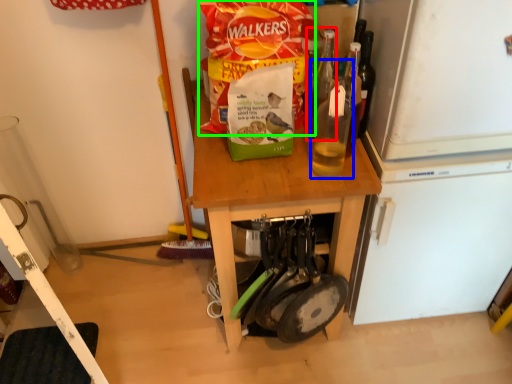
Question: Considering the real-world distances, which object is closest to bottle (highlighted by a red box)? bottle (highlighted by a blue box) or cereal (highlighted by a green box).

Choices:
 (A) bottle
 (B) cereal

Answer: (A)